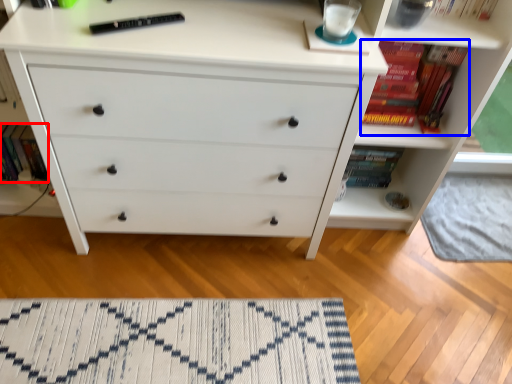
Question: Among these objects, which one is farthest to the camera, book (highlighted by a red box) or book (highlighted by a blue box)?

Choices:
 (A) book
 (B) book

Answer: (A)